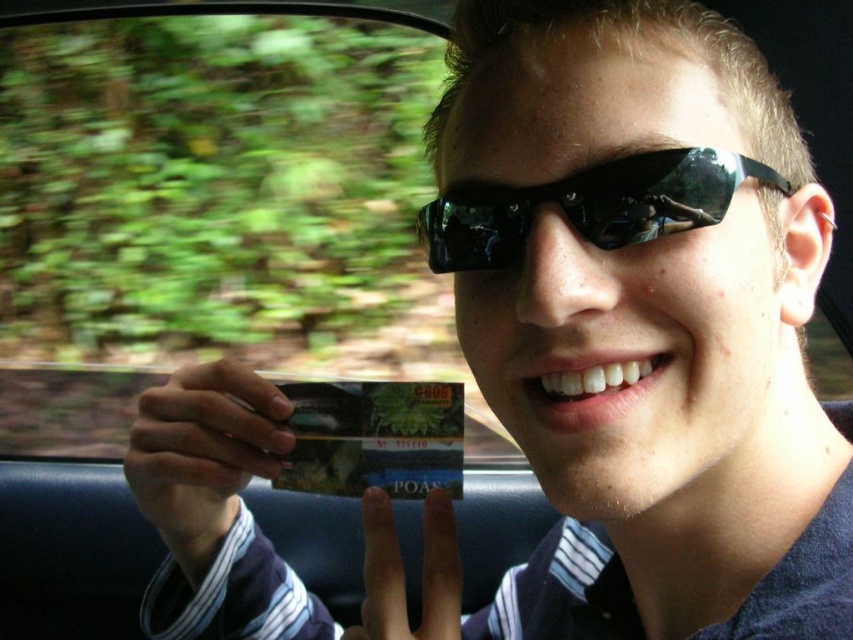
Question: Which point is farther to the camera?

Choices:
 (A) black reflective sunglasses at center
 (B) metallic green credit card at center

Answer: (B)

Question: Can you confirm if black reflective sunglasses at center is positioned to the right of metallic green credit card at center?

Choices:
 (A) no
 (B) yes

Answer: (B)

Question: In this image, where is black reflective sunglasses at center located relative to metallic green credit card at center?

Choices:
 (A) below
 (B) above

Answer: (B)

Question: Which of the following is the farthest from the observer?

Choices:
 (A) metallic green credit card at center
 (B) black reflective sunglasses at center

Answer: (A)

Question: Does black reflective sunglasses at center appear under metallic green credit card at center?

Choices:
 (A) yes
 (B) no

Answer: (B)